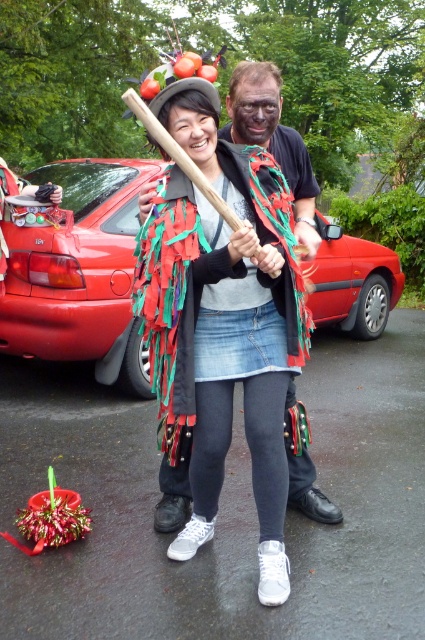
Who is more distant from viewer, [68,273] or [172,486]?

The point [68,273] is more distant.

Is red matte car at center taller than multicolored fabric cape at center?

Yes.

Who is more distant from viewer, (x=74, y=243) or (x=288, y=456)?

The point (x=74, y=243) is more distant.

At what (x,y) coordinates should I click in order to perform the action: click on red matte car at center. Please return your answer as a coordinate pair (x, y). Looking at the image, I should click on (79, 272).